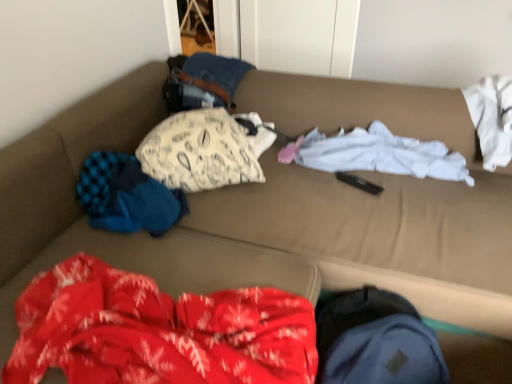
Find the location of a particular element. This screenshot has height=384, width=512. white cotton shirt at center, the first clothing in the right-to-left sequence is located at coordinates coord(381,154).

Where is `white printed pillow at center, the 2th clothing positioned from the left`? This screenshot has height=384, width=512. white printed pillow at center, the 2th clothing positioned from the left is located at coordinates (200, 151).

The width and height of the screenshot is (512, 384). I want to click on white cotton shirt at center, the first clothing in the right-to-left sequence, so 381,154.

Would you say white cotton shirt at center, which appears as the 3th clothing when viewed from the left, is part of white printed pillow at center, the second clothing from the right,'s contents?

Actually, white cotton shirt at center, which appears as the 3th clothing when viewed from the left, is outside white printed pillow at center, the second clothing from the right.

From the image's perspective, is white printed pillow at center, the second clothing from the right, on top of white cotton shirt at center, the first clothing in the right-to-left sequence?

Yes.

Identify the location of the 1st clothing in front of the white cotton shirt at center, the first clothing in the right-to-left sequence, starting your count from the anchor. The image size is (512, 384). (200, 151).

Is white printed pillow at center, the 2th clothing positioned from the left, placed right next to white cotton shirt at center, which appears as the 3th clothing when viewed from the left?

There is a gap between white printed pillow at center, the 2th clothing positioned from the left, and white cotton shirt at center, which appears as the 3th clothing when viewed from the left.

From a real-world perspective, which is physically above, blue knitted sweater at left, the 3th clothing when ordered from right to left, or white printed pillow at center, the second clothing from the right?

From a 3D spatial view, white printed pillow at center, the second clothing from the right, is above.

Is blue knitted sweater at left, marked as the 1th clothing in a left-to-right arrangement, taller than white printed pillow at center, the 2th clothing positioned from the left?

No.

Could you tell me if blue knitted sweater at left, the 3th clothing when ordered from right to left, is turned towards white printed pillow at center, the second clothing from the right?

Yes, blue knitted sweater at left, the 3th clothing when ordered from right to left, is turned towards white printed pillow at center, the second clothing from the right.

What's the angular difference between blue knitted sweater at left, marked as the 1th clothing in a left-to-right arrangement, and white printed pillow at center, the second clothing from the right,'s facing directions?

22 degrees.

Who is more distant, white cotton shirt at center, the first clothing in the right-to-left sequence, or blue knitted sweater at left, marked as the 1th clothing in a left-to-right arrangement?

white cotton shirt at center, the first clothing in the right-to-left sequence, is further away from the camera.

Can you confirm if white cotton shirt at center, which appears as the 3th clothing when viewed from the left, is bigger than blue knitted sweater at left, the 3th clothing when ordered from right to left?

Correct, white cotton shirt at center, which appears as the 3th clothing when viewed from the left, is larger in size than blue knitted sweater at left, the 3th clothing when ordered from right to left.

Measure the distance between white cotton shirt at center, which appears as the 3th clothing when viewed from the left, and blue knitted sweater at left, the 3th clothing when ordered from right to left.

27.14 inches.

Between point (315, 166) and point (138, 216), which one is positioned behind?

The point (315, 166) is farther.

Is white cotton shirt at center, which appears as the 3th clothing when viewed from the left, oriented away from white printed pillow at center, the 2th clothing positioned from the left?

No, white printed pillow at center, the 2th clothing positioned from the left, is not at the back of white cotton shirt at center, which appears as the 3th clothing when viewed from the left.

Does white cotton shirt at center, which appears as the 3th clothing when viewed from the left, come in front of white printed pillow at center, the second clothing from the right?

No, white cotton shirt at center, which appears as the 3th clothing when viewed from the left, is further to the viewer.

Are white cotton shirt at center, which appears as the 3th clothing when viewed from the left, and white printed pillow at center, the second clothing from the right, making contact?

Result: No, white cotton shirt at center, which appears as the 3th clothing when viewed from the left, is not making contact with white printed pillow at center, the second clothing from the right.

Which is less distant, (389, 150) or (145, 169)?

Point (389, 150) appears to be farther away from the viewer than point (145, 169).

Is blue knitted sweater at left, the 3th clothing when ordered from right to left, taller or shorter than white cotton shirt at center, which appears as the 3th clothing when viewed from the left?

Clearly, blue knitted sweater at left, the 3th clothing when ordered from right to left, is taller compared to white cotton shirt at center, which appears as the 3th clothing when viewed from the left.

Does blue knitted sweater at left, marked as the 1th clothing in a left-to-right arrangement, appear on the right side of white cotton shirt at center, the first clothing in the right-to-left sequence?

Incorrect, blue knitted sweater at left, marked as the 1th clothing in a left-to-right arrangement, is not on the right side of white cotton shirt at center, the first clothing in the right-to-left sequence.

Is blue knitted sweater at left, the 3th clothing when ordered from right to left, not within white cotton shirt at center, the first clothing in the right-to-left sequence?

Yes, blue knitted sweater at left, the 3th clothing when ordered from right to left, is located beyond the bounds of white cotton shirt at center, the first clothing in the right-to-left sequence.

Does blue knitted sweater at left, marked as the 1th clothing in a left-to-right arrangement, have a greater width compared to white cotton shirt at center, which appears as the 3th clothing when viewed from the left?

Indeed, blue knitted sweater at left, marked as the 1th clothing in a left-to-right arrangement, has a greater width compared to white cotton shirt at center, which appears as the 3th clothing when viewed from the left.

I want to click on clothing that is the 2nd one when counting upward from the blue knitted sweater at left, marked as the 1th clothing in a left-to-right arrangement (from the image's perspective), so click(x=200, y=151).

Considering the points (230, 177) and (92, 223), which point is in front, point (230, 177) or point (92, 223)?

Positioned in front is point (92, 223).

Considering the relative sizes of white printed pillow at center, the second clothing from the right, and blue knitted sweater at left, marked as the 1th clothing in a left-to-right arrangement, in the image provided, is white printed pillow at center, the second clothing from the right, smaller than blue knitted sweater at left, marked as the 1th clothing in a left-to-right arrangement,?

Actually, white printed pillow at center, the second clothing from the right, might be larger than blue knitted sweater at left, marked as the 1th clothing in a left-to-right arrangement.

At what (x,y) coordinates should I click in order to perform the action: click on the 2nd clothing positioned below the white printed pillow at center, the second clothing from the right (from a real-world perspective). Please return your answer as a coordinate pair (x, y). The image size is (512, 384). Looking at the image, I should click on (381, 154).

Which clothing is the 1st one when counting from the right side of the blue knitted sweater at left, marked as the 1th clothing in a left-to-right arrangement? Please provide its 2D coordinates.

[(200, 151)]

Looking at the image, which one is located closer to white printed pillow at center, the 2th clothing positioned from the left, white cotton shirt at center, which appears as the 3th clothing when viewed from the left, or blue knitted sweater at left, marked as the 1th clothing in a left-to-right arrangement?

Based on the image, blue knitted sweater at left, marked as the 1th clothing in a left-to-right arrangement, appears to be nearer to white printed pillow at center, the 2th clothing positioned from the left.

Considering their positions, is white cotton shirt at center, the first clothing in the right-to-left sequence, positioned further to blue knitted sweater at left, marked as the 1th clothing in a left-to-right arrangement, than white printed pillow at center, the 2th clothing positioned from the left?

white cotton shirt at center, the first clothing in the right-to-left sequence, is further to blue knitted sweater at left, marked as the 1th clothing in a left-to-right arrangement.

Which object lies further to the anchor point white printed pillow at center, the second clothing from the right, blue knitted sweater at left, the 3th clothing when ordered from right to left, or white cotton shirt at center, which appears as the 3th clothing when viewed from the left?

Based on the image, white cotton shirt at center, which appears as the 3th clothing when viewed from the left, appears to be further to white printed pillow at center, the second clothing from the right.

Based on their spatial positions, is blue knitted sweater at left, the 3th clothing when ordered from right to left, or white printed pillow at center, the 2th clothing positioned from the left, closer to white cotton shirt at center, which appears as the 3th clothing when viewed from the left?

white printed pillow at center, the 2th clothing positioned from the left, lies closer to white cotton shirt at center, which appears as the 3th clothing when viewed from the left, than the other object.

Estimate the real-world distances between objects in this image. Which object is further from blue knitted sweater at left, marked as the 1th clothing in a left-to-right arrangement, white printed pillow at center, the 2th clothing positioned from the left, or white cotton shirt at center, the first clothing in the right-to-left sequence?

The object further to blue knitted sweater at left, marked as the 1th clothing in a left-to-right arrangement, is white cotton shirt at center, the first clothing in the right-to-left sequence.

From the image, which object appears to be farther from white cotton shirt at center, the first clothing in the right-to-left sequence, white printed pillow at center, the 2th clothing positioned from the left, or blue knitted sweater at left, the 3th clothing when ordered from right to left?

The object further to white cotton shirt at center, the first clothing in the right-to-left sequence, is blue knitted sweater at left, the 3th clothing when ordered from right to left.

I want to click on clothing located between blue knitted sweater at left, the 3th clothing when ordered from right to left, and white cotton shirt at center, which appears as the 3th clothing when viewed from the left, in the left-right direction, so click(200, 151).